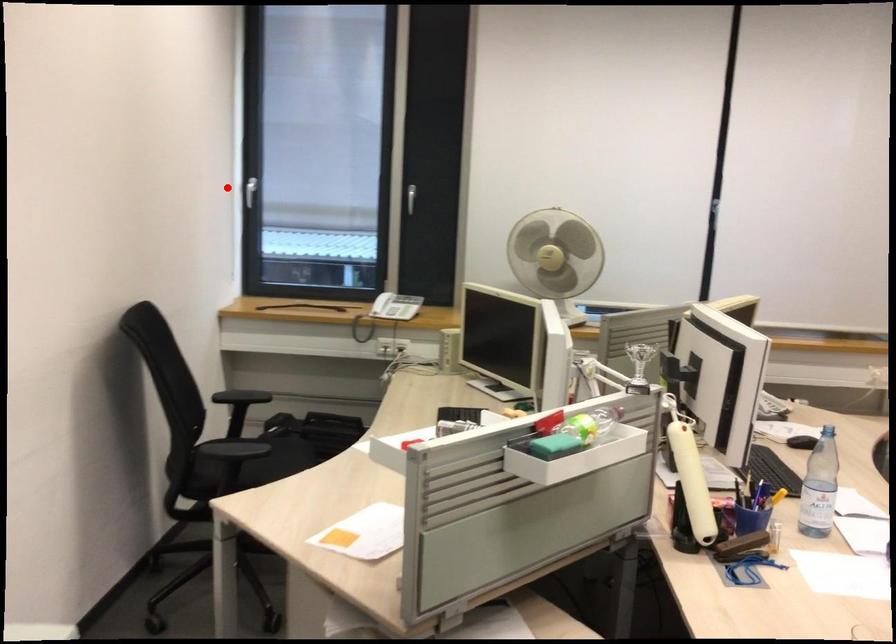
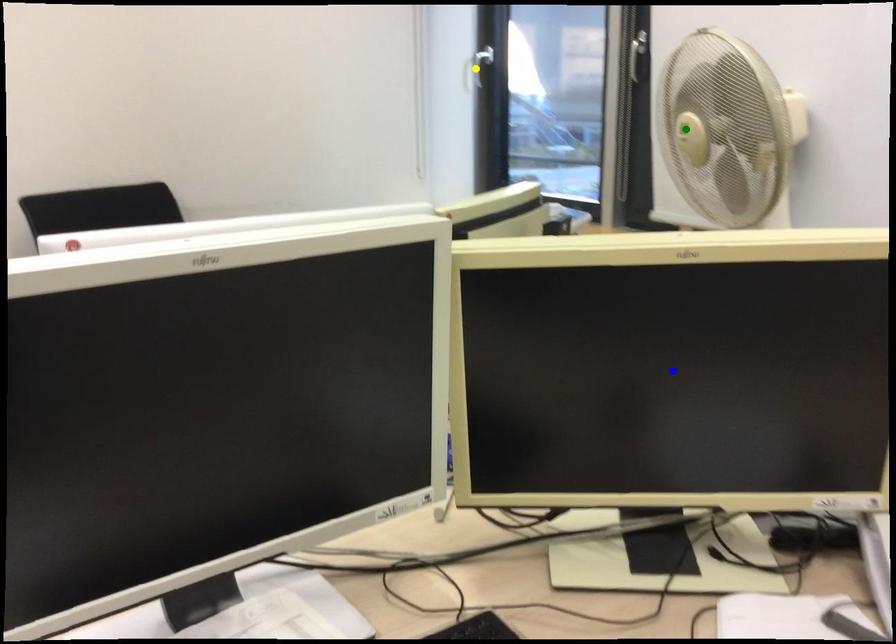
Question: I am providing you with two images of the same scene from different viewpoints. A red point is marked on the first image. You are given multiple points on the second image. Which spot in image 2 lines up with the point in image 1?

Choices:
 (A) yellow point
 (B) blue point
 (C) green point

Answer: (A)